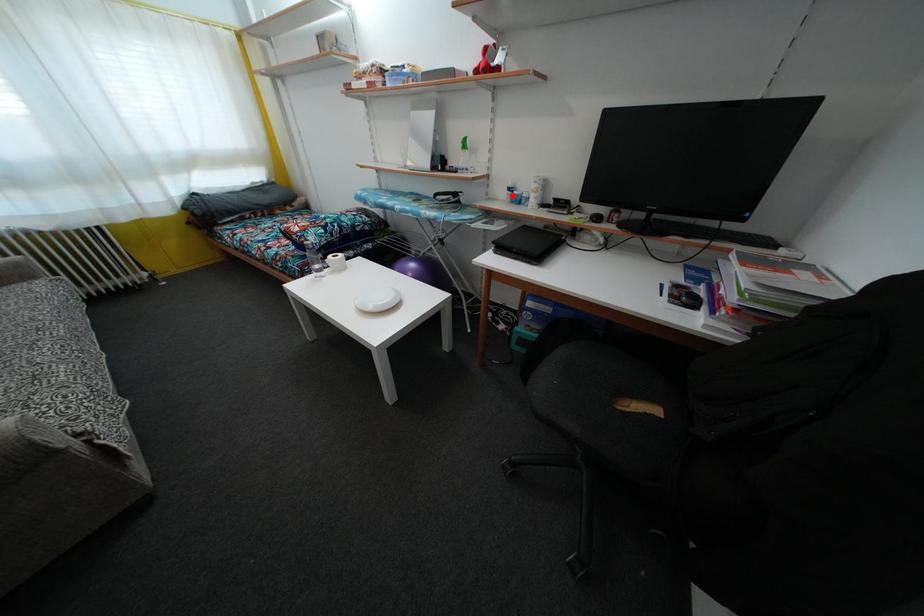
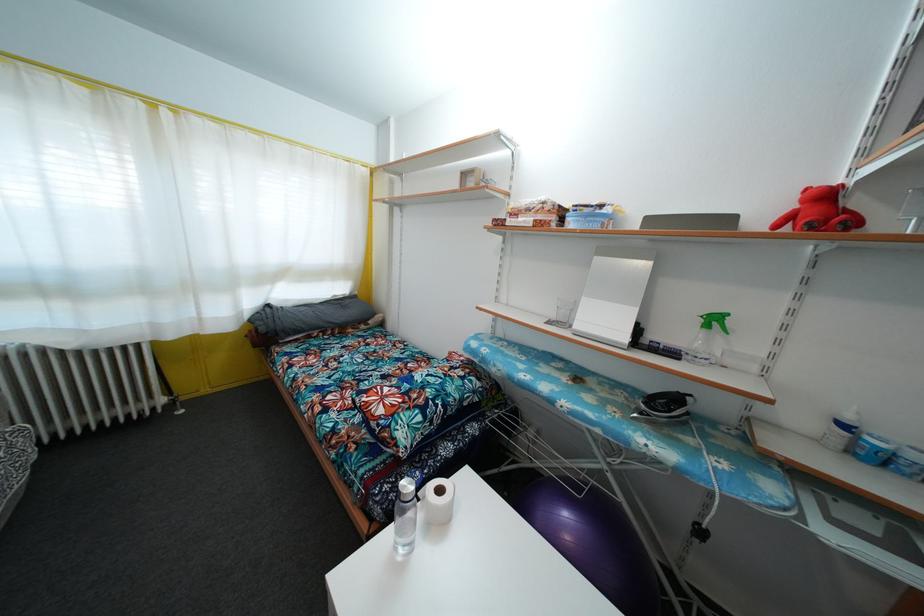
Question: I am providing you with two images of the same scene from different viewpoints. In image1, a red point is highlighted. Considering the same 3D point in image2, which of the following is correct?

Choices:
 (A) It is closer
 (B) It is farther

Answer: (B)